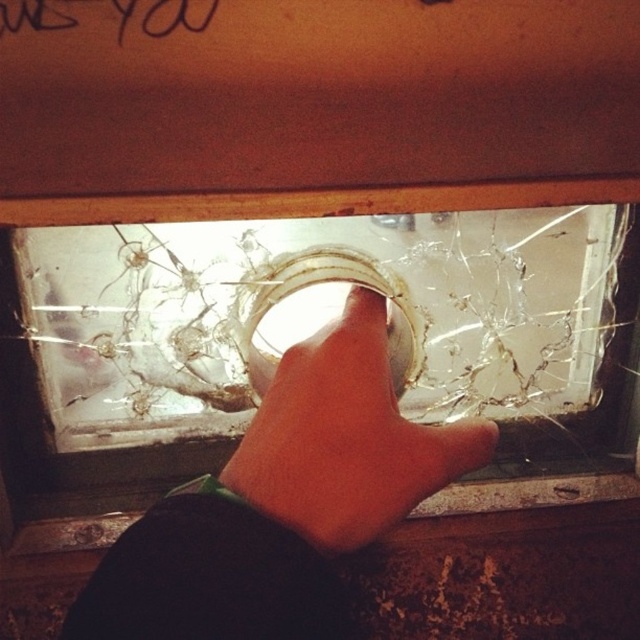
Question: Estimate the real-world distances between objects in this image. Which object is closer to the smooth skin hand at center?

Choices:
 (A) transparent glass window at center
 (B) light skin hand at center
 (C) black ink writing at upper left

Answer: (B)

Question: Is light skin hand at center above smooth skin hand at center?

Choices:
 (A) no
 (B) yes

Answer: (A)

Question: Considering the relative positions of transparent glass window at center and light skin hand at center in the image provided, where is transparent glass window at center located with respect to light skin hand at center?

Choices:
 (A) above
 (B) below

Answer: (A)

Question: Which object is positioned farthest from the smooth skin hand at center?

Choices:
 (A) black ink writing at upper left
 (B) light skin hand at center
 (C) transparent glass window at center

Answer: (A)

Question: Does smooth skin hand at center have a greater width compared to black ink writing at upper left?

Choices:
 (A) yes
 (B) no

Answer: (A)

Question: Estimate the real-world distances between objects in this image. Which object is farther from the light skin hand at center?

Choices:
 (A) black ink writing at upper left
 (B) transparent glass window at center
 (C) smooth skin hand at center

Answer: (A)